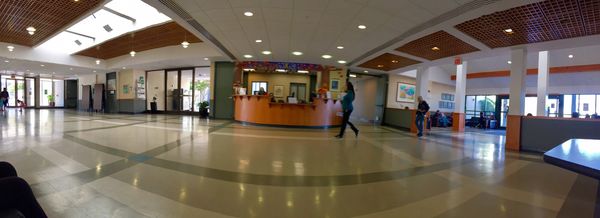
Locate an element on the screen. art is located at coordinates (405, 93).